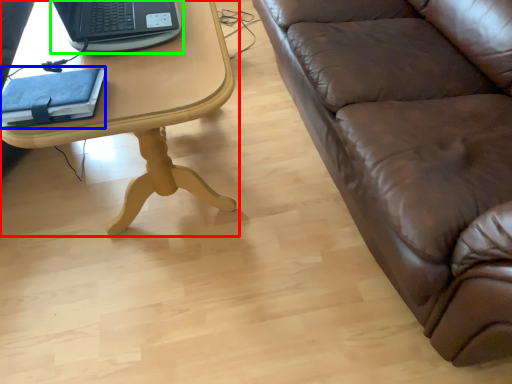
Question: Which object is positioned closest to table (highlighted by a red box)? Select from notebook (highlighted by a blue box) and laptop (highlighted by a green box).

Choices:
 (A) notebook
 (B) laptop

Answer: (B)